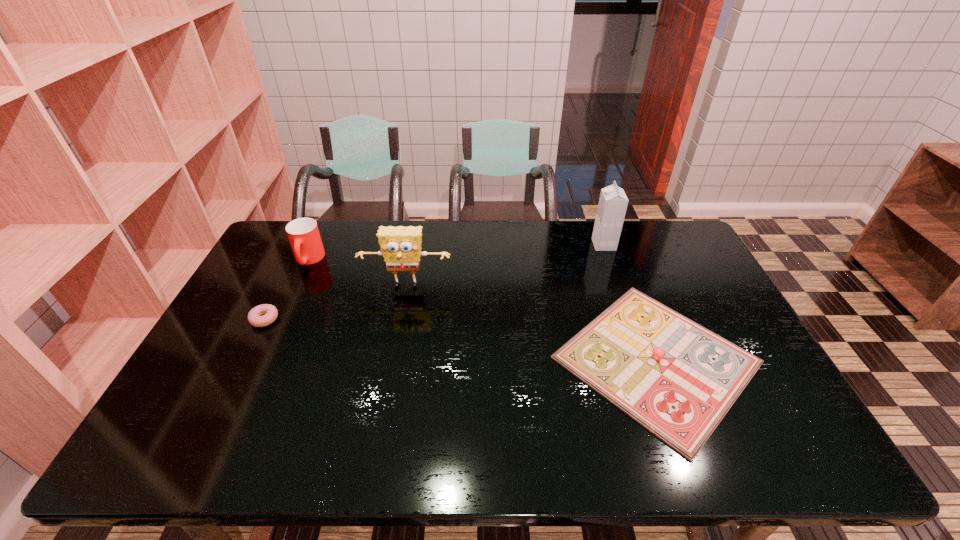
I want to click on carton, so (612, 206).

The height and width of the screenshot is (540, 960). In order to click on the third object from left to right in this screenshot , I will do `click(400, 246)`.

What are the coordinates of `the third tallest object` in the screenshot? It's located at (303, 233).

The height and width of the screenshot is (540, 960). In order to click on the second shortest object in this screenshot , I will do `click(677, 379)`.

Find the location of a particular element. the shortest object is located at coordinates (269, 312).

Where is `vacant area situated on the front label of the carton`? The image size is (960, 540). vacant area situated on the front label of the carton is located at coordinates (521, 245).

What are the coordinates of `free space located 0.230m on the front label of the carton` in the screenshot? It's located at (529, 245).

You are a GUI agent. You are given a task and a screenshot of the screen. Output one action in this format:
    pyautogui.click(x=<x>, y=<y>)
    Task: Click on the free space located on the front label of the carton
    
    Given the screenshot: What is the action you would take?
    pyautogui.click(x=482, y=245)

You are a GUI agent. You are given a task and a screenshot of the screen. Output one action in this format:
    pyautogui.click(x=<x>, y=<y>)
    Task: Click on the vacant space located 0.170m on the face of the third object from right to left
    
    Given the screenshot: What is the action you would take?
    pyautogui.click(x=396, y=338)

This screenshot has width=960, height=540. What are the coordinates of `vacant position located on the side of the third tallest object with the handle` in the screenshot? It's located at (296, 287).